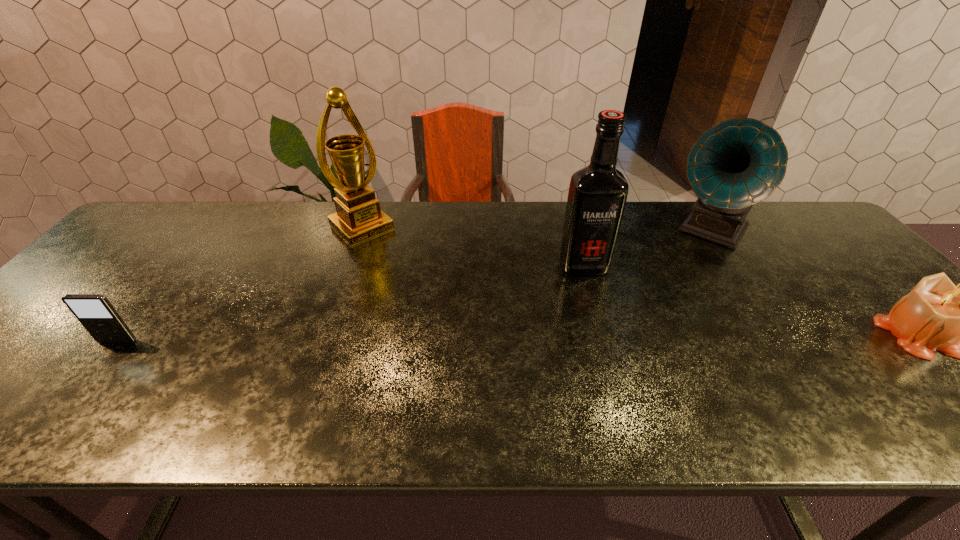
This screenshot has width=960, height=540. In the image, there is a desktop. In order to click on free space at the left edge in this screenshot , I will do `click(70, 322)`.

Where is `vacant space at the far left corner`? Image resolution: width=960 pixels, height=540 pixels. vacant space at the far left corner is located at coordinates (203, 201).

You are a GUI agent. You are given a task and a screenshot of the screen. Output one action in this format:
    pyautogui.click(x=<x>, y=<y>)
    Task: Click on the vacant position at the far right corner of the desktop
    The width and height of the screenshot is (960, 540).
    Given the screenshot: What is the action you would take?
    pyautogui.click(x=793, y=245)

The image size is (960, 540). In order to click on empty space that is in between the award and the phonograph_record in this screenshot , I will do `click(536, 230)`.

Where is `vacant point located between the leftmost object and the phonograph_record`? This screenshot has height=540, width=960. vacant point located between the leftmost object and the phonograph_record is located at coordinates (414, 287).

Locate an element on the screen. Image resolution: width=960 pixels, height=540 pixels. vacant space that's between the leftmost object and the liquor is located at coordinates (350, 303).

Image resolution: width=960 pixels, height=540 pixels. Find the location of `vacant space in between the second object from left to right and the phonograph_record`. vacant space in between the second object from left to right and the phonograph_record is located at coordinates (536, 230).

Find the location of a particular element. The height and width of the screenshot is (540, 960). object that is the second closest to the third object from left to right is located at coordinates 358,218.

Identify which object is the closest to the iPod. Please provide its 2D coordinates. Your answer should be formatted as a tuple, i.e. [(x, y)], where the tuple contains the x and y coordinates of a point satisfying the conditions above.

[(358, 218)]

This screenshot has width=960, height=540. What are the coordinates of `free space that satisfies the following two spatial constraints: 1. on the front side of the award; 2. on the right side of the liquor` in the screenshot? It's located at (348, 265).